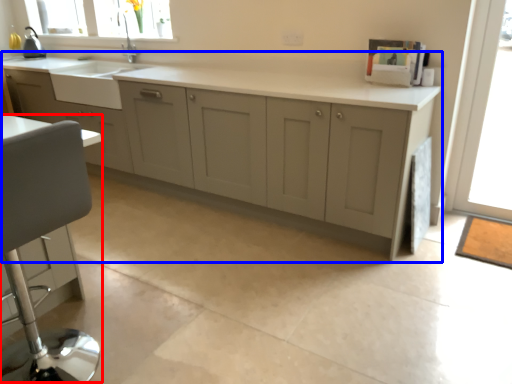
Question: Among these objects, which one is farthest to the camera, swivel chair (highlighted by a red box) or cabinetry (highlighted by a blue box)?

Choices:
 (A) swivel chair
 (B) cabinetry

Answer: (B)